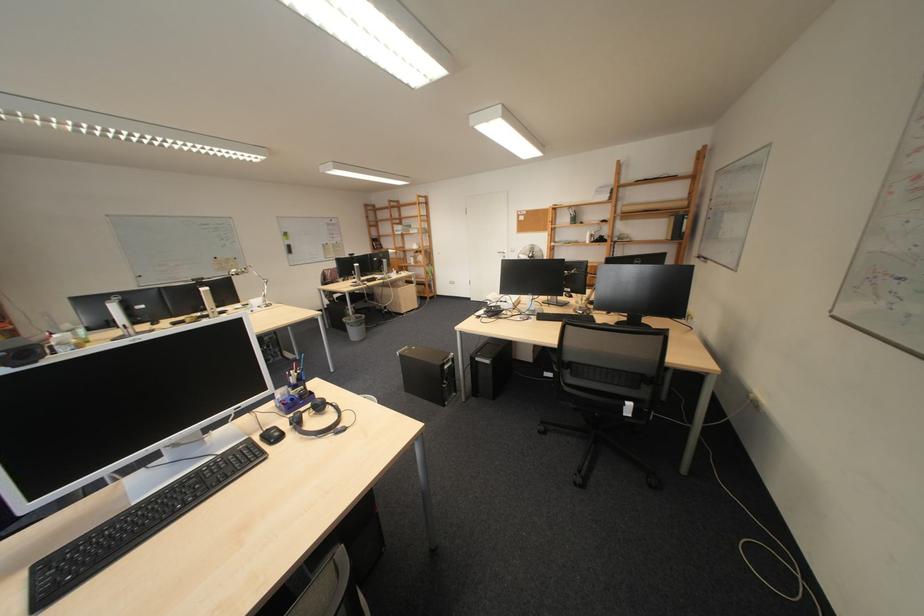
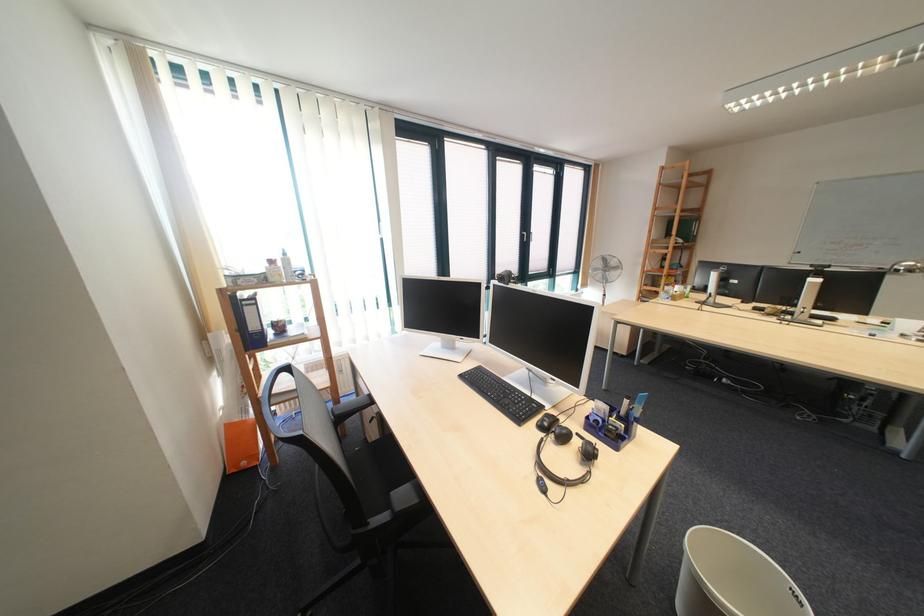
Where in the second image is the point corresponding to (306,400) from the first image?

(611, 423)